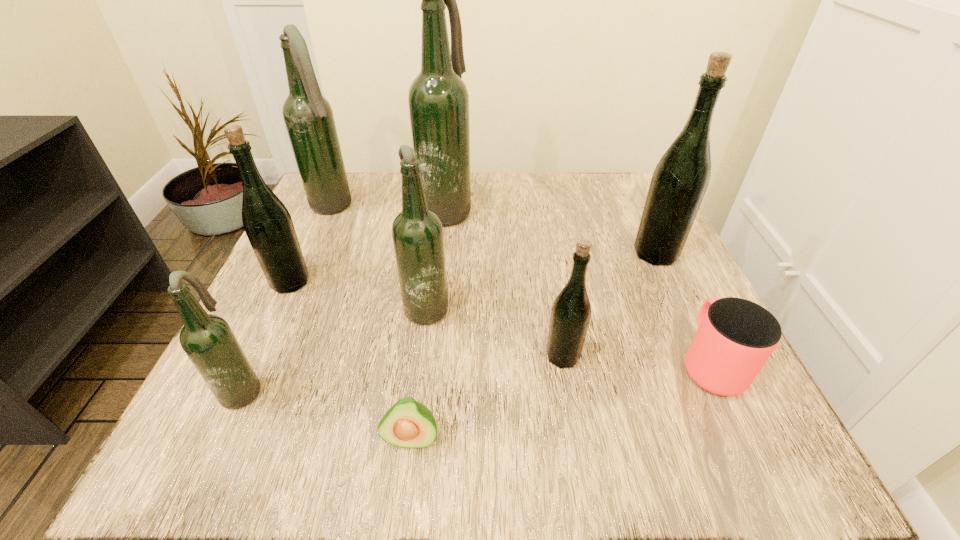
At what (x,y) coordinates should I click in order to perform the action: click on the tallest beer bottle. Please return your answer as a coordinate pair (x, y). This screenshot has height=540, width=960. Looking at the image, I should click on (438, 99).

Locate an element on the screen. the tallest object is located at coordinates (438, 99).

Where is `the third farthest object`? the third farthest object is located at coordinates (680, 180).

The width and height of the screenshot is (960, 540). Identify the location of the farthest green beer bottle. (680, 180).

This screenshot has height=540, width=960. I want to click on the third smallest dark beer bottle, so click(x=308, y=116).

Identify the location of the second nearest green beer bottle. Image resolution: width=960 pixels, height=540 pixels. (268, 225).

Where is `the leftmost green beer bottle`? Image resolution: width=960 pixels, height=540 pixels. the leftmost green beer bottle is located at coordinates (268, 225).

The width and height of the screenshot is (960, 540). I want to click on the second nearest dark beer bottle, so click(417, 232).

Where is `the nearest green beer bottle`? The width and height of the screenshot is (960, 540). the nearest green beer bottle is located at coordinates (571, 311).

At what (x,y) coordinates should I click in order to perform the action: click on the second green beer bottle from right to left. Please return your answer as a coordinate pair (x, y). The image size is (960, 540). Looking at the image, I should click on (571, 311).